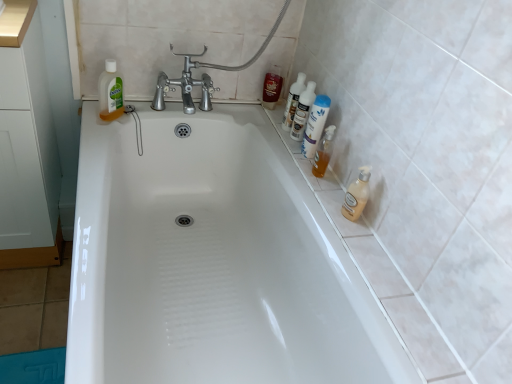
The image size is (512, 384). I want to click on free point in front of translucent plastic bottle at upper left, the first cleaning product when ordered from left to right, so click(x=99, y=132).